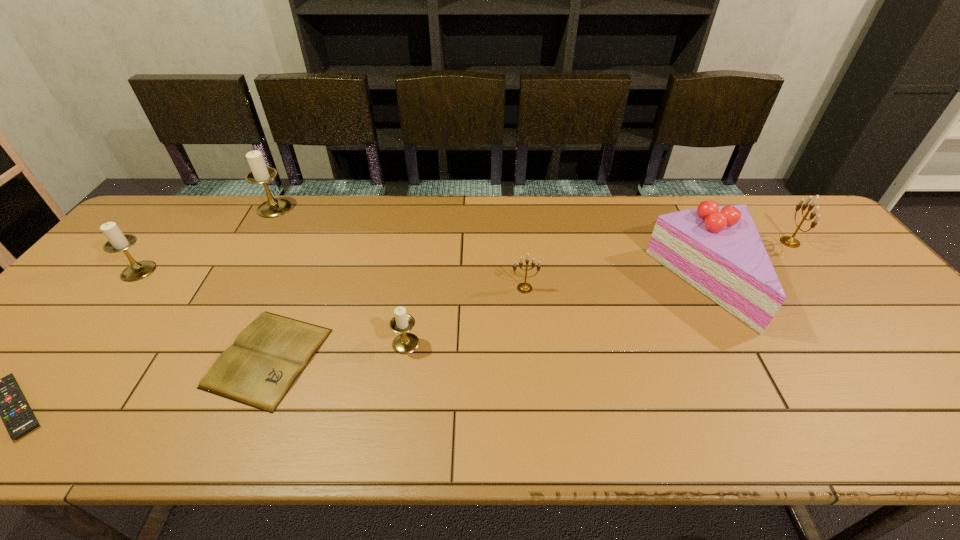
Locate which object is the second closest to the shortest object. Please provide its 2D coordinates. Your answer should be formatted as a tuple, i.e. [(x, y)], where the tuple contains the x and y coordinates of a point satisfying the conditions above.

[(117, 241)]

Select which candle holder appears as the third closest to the fourth candle holder from left to right. Please provide its 2D coordinates. Your answer should be formatted as a tuple, i.e. [(x, y)], where the tuple contains the x and y coordinates of a point satisfying the conditions above.

[(260, 174)]

The width and height of the screenshot is (960, 540). Identify the location of candle holder that stands as the third closest to the second smallest white candle holder. (524, 287).

Point out which white candle holder is positioned as the nearest to the seventh tallest object. Please provide its 2D coordinates. Your answer should be formatted as a tuple, i.e. [(x, y)], where the tuple contains the x and y coordinates of a point satisfying the conditions above.

[(405, 343)]

I want to click on white candle holder that is the closest to the third nearest candle holder, so click(x=260, y=174).